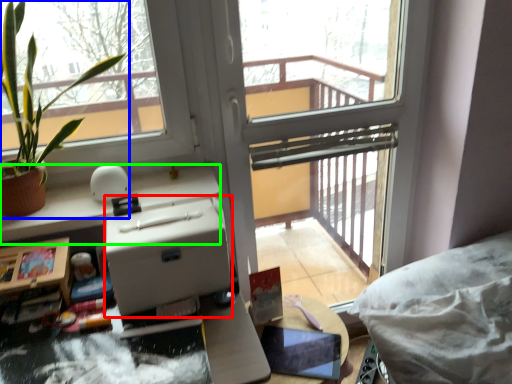
Question: Considering the real-world distances, which object is closest to cardboard box (highlighted by a red box)? houseplant (highlighted by a blue box) or counter top (highlighted by a green box).

Choices:
 (A) houseplant
 (B) counter top

Answer: (B)